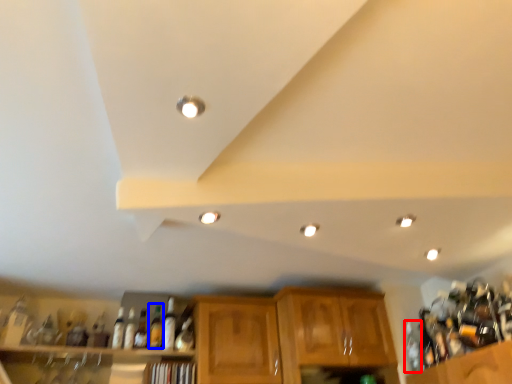
Question: Which point is further to the camera, bottle (highlighted by a red box) or beverage (highlighted by a blue box)?

Choices:
 (A) bottle
 (B) beverage

Answer: (B)